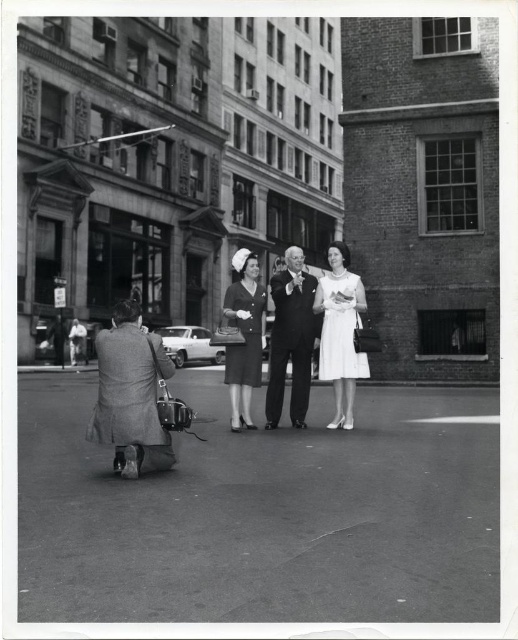
Question: Which point is farther from the camera taking this photo?

Choices:
 (A) (227, 358)
 (B) (125, 476)
 (C) (304, 346)
 (D) (347, 305)

Answer: (C)

Question: Among these points, which one is nearest to the camera?

Choices:
 (A) (272, 333)
 (B) (339, 305)
 (C) (160, 433)
 (D) (242, 308)

Answer: (C)

Question: Does smooth black suit at center have a lesser width compared to matte black dress at center?

Choices:
 (A) yes
 (B) no

Answer: (B)

Question: Considering the relative positions of smooth black suit at center and white satin dress at center in the image provided, where is smooth black suit at center located with respect to white satin dress at center?

Choices:
 (A) right
 (B) left

Answer: (B)

Question: Estimate the real-world distances between objects in this image. Which object is closer to the smooth black suit at center?

Choices:
 (A) white satin dress at center
 (B) matte black dress at center

Answer: (B)

Question: Is matte black coat at lower left bigger than white satin dress at center?

Choices:
 (A) no
 (B) yes

Answer: (A)